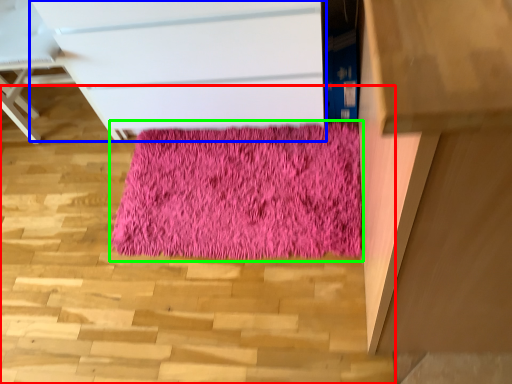
Question: Based on their relative distances, which object is nearer to stairwell (highlighted by a red box)? Choose from chest of drawers (highlighted by a blue box) and mat (highlighted by a green box).

Choices:
 (A) chest of drawers
 (B) mat

Answer: (B)